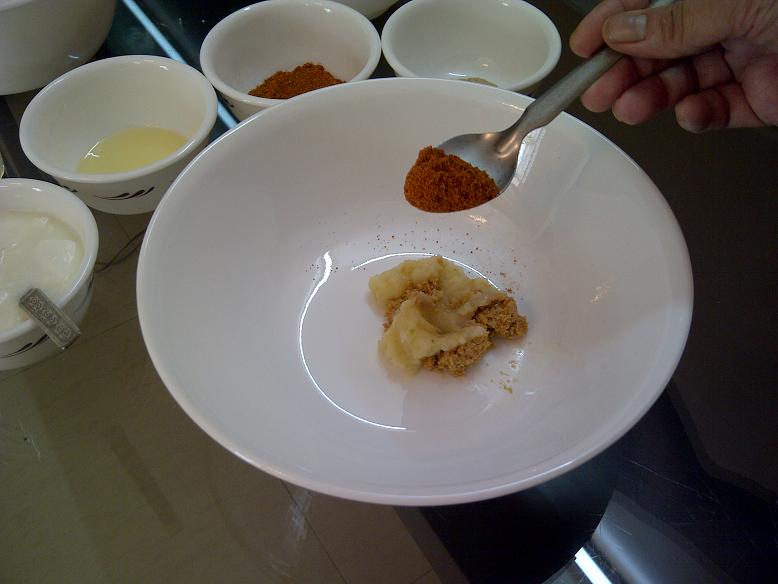
What are the coordinates of `spoon` in the screenshot? It's located at (468, 158).